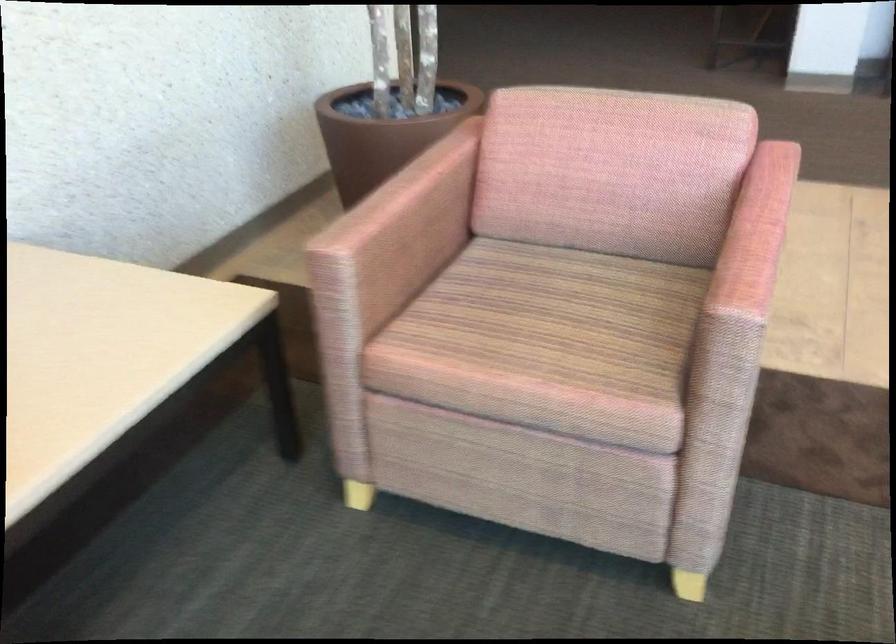
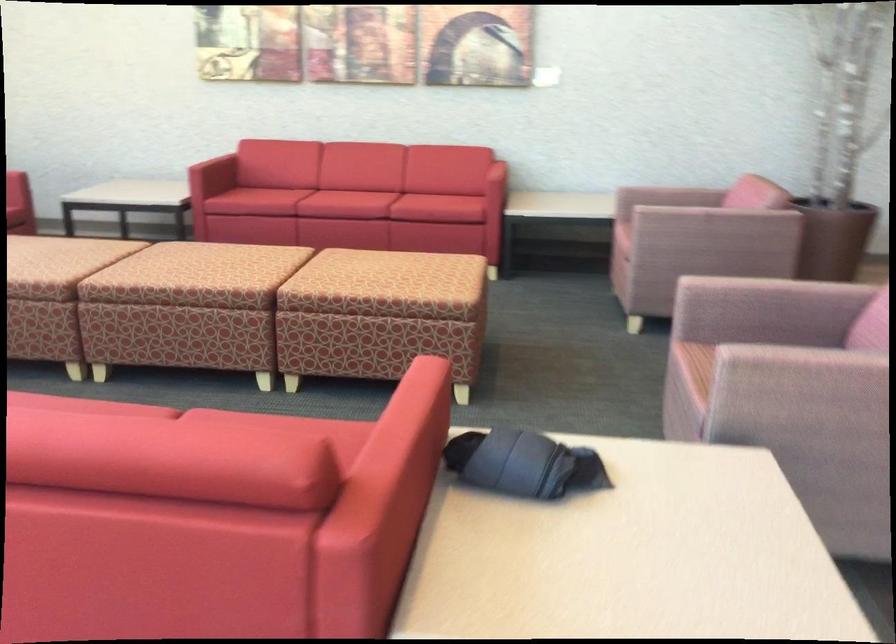
Question: I am providing you with two images of the same scene from different viewpoints. Please identify which objects are invisible in image2.

Choices:
 (A) red sofa sitting surface
 (B) rolled up clothing
 (C) red sofa armrest
 (D) none of these

Answer: (D)